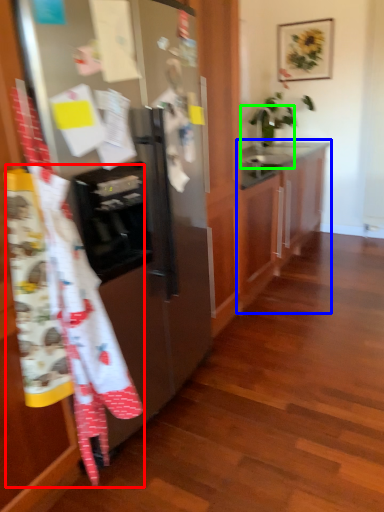
Question: Which is farther away from blanket (highlighted by a red box)? cabinetry (highlighted by a blue box) or sink (highlighted by a green box)?

Choices:
 (A) cabinetry
 (B) sink

Answer: (B)